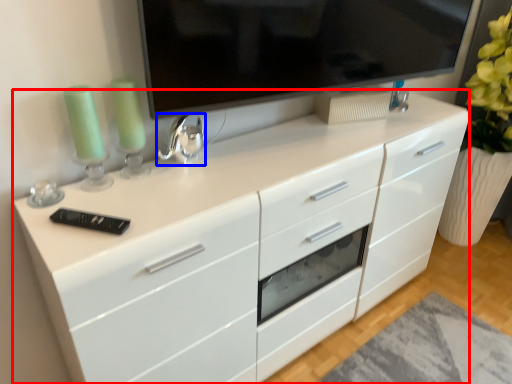
Question: Which object is closer to the camera taking this photo, chest of drawers (highlighted by a red box) or appliance (highlighted by a blue box)?

Choices:
 (A) chest of drawers
 (B) appliance

Answer: (A)